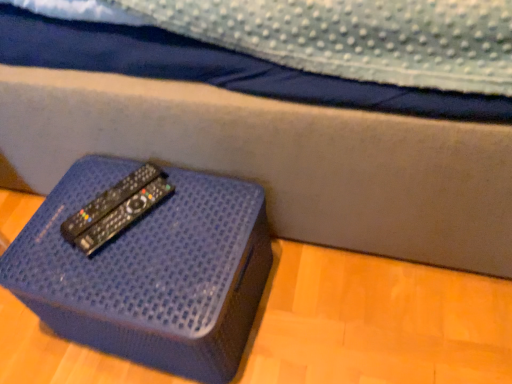
Image resolution: width=512 pixels, height=384 pixels. In order to click on free location to the right of black plastic remote at center in this screenshot , I will do `click(199, 206)`.